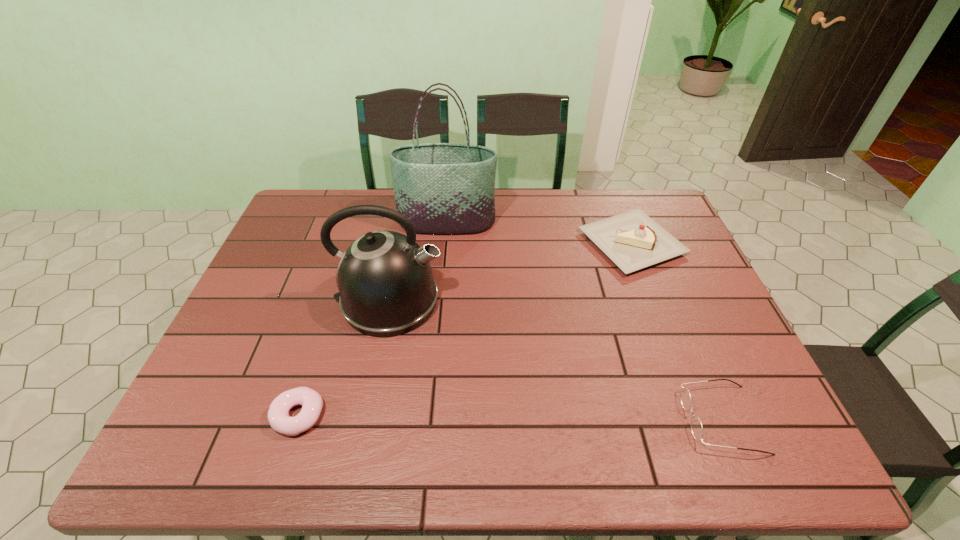
Image resolution: width=960 pixels, height=540 pixels. In the image, there is a desktop. Identify the location of free space at the far edge. (561, 229).

Find the location of a particular element. The image size is (960, 540). vacant space at the near edge of the desktop is located at coordinates (691, 451).

Locate an element on the screen. free space at the left edge is located at coordinates (256, 399).

Image resolution: width=960 pixels, height=540 pixels. In the image, there is a desktop. What are the coordinates of `free region at the right edge` in the screenshot? It's located at (706, 312).

In the image, there is a desktop. At what (x,y) coordinates should I click in order to perform the action: click on free space at the far left corner. Please return your answer as a coordinate pair (x, y). The width and height of the screenshot is (960, 540). Looking at the image, I should click on (317, 188).

The image size is (960, 540). I want to click on free location at the near left corner of the desktop, so click(x=166, y=460).

This screenshot has height=540, width=960. Find the location of `vacant area at the far right corner of the desktop`. vacant area at the far right corner of the desktop is located at coordinates (638, 206).

This screenshot has height=540, width=960. In order to click on free space at the near right corner of the desktop in this screenshot , I will do `click(763, 431)`.

The width and height of the screenshot is (960, 540). In order to click on vacant space in between the kettle and the spectacles in this screenshot , I will do `click(556, 360)`.

At what (x,y) coordinates should I click in order to perform the action: click on vacant area between the doughnut and the second tallest object. Please return your answer as a coordinate pair (x, y). Looking at the image, I should click on (344, 358).